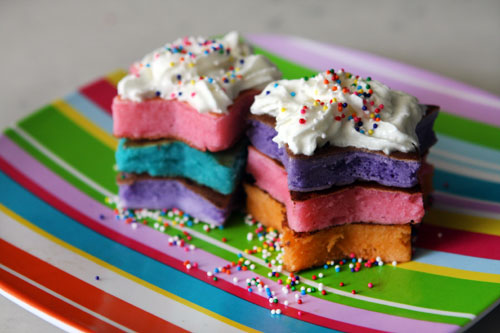
I want to click on plate, so click(x=70, y=271).